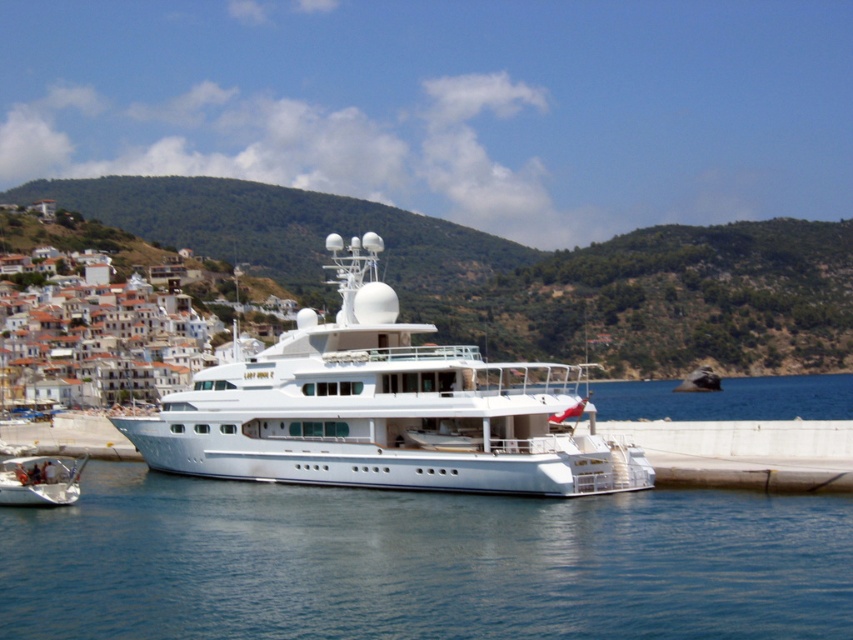
Where is `transparent blue water at lower center`? This screenshot has height=640, width=853. transparent blue water at lower center is located at coordinates (419, 563).

Between transparent blue water at lower center and green leafy hillside at upper left, which one appears on the right side from the viewer's perspective?

Positioned to the right is green leafy hillside at upper left.

I want to click on transparent blue water at lower center, so point(419,563).

This screenshot has height=640, width=853. What are the coordinates of `transparent blue water at lower center` in the screenshot? It's located at (419, 563).

Who is shorter, green leafy hillside at upper left or white glossy dinghy at lower left?

With less height is white glossy dinghy at lower left.

From the picture: Is green leafy hillside at upper left closer to camera compared to white glossy dinghy at lower left?

No, it is behind white glossy dinghy at lower left.

Image resolution: width=853 pixels, height=640 pixels. Identify the location of green leafy hillside at upper left. (527, 273).

Who is positioned more to the left, green leafy hillside at upper left or white glossy cruise ship at center?

From the viewer's perspective, white glossy cruise ship at center appears more on the left side.

Between point (595, 348) and point (474, 413), which one is positioned in front?

Point (474, 413) is in front.

Image resolution: width=853 pixels, height=640 pixels. I want to click on green leafy hillside at upper left, so click(527, 273).

Locate an element on the screen. Image resolution: width=853 pixels, height=640 pixels. green leafy hillside at upper left is located at coordinates (527, 273).